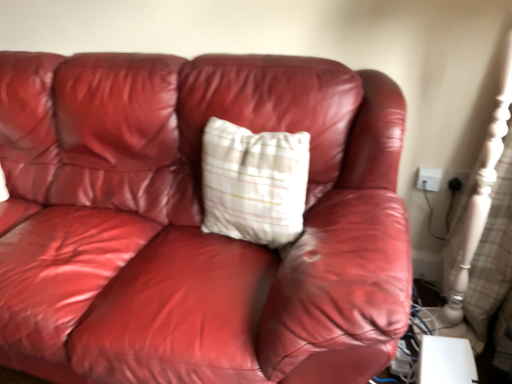
Question: Does plaid fabric pillow at center have a lesser height compared to black plastic outlet at upper right, the 1th electric outlet positioned from the right?

Choices:
 (A) yes
 (B) no

Answer: (B)

Question: Is plaid fabric pillow at center next to black plastic outlet at upper right, the 1th electric outlet positioned from the right?

Choices:
 (A) no
 (B) yes

Answer: (A)

Question: From the image's perspective, is plaid fabric pillow at center below black plastic outlet at upper right, the 2th electric outlet positioned from the left?

Choices:
 (A) yes
 (B) no

Answer: (A)

Question: Does plaid fabric pillow at center come behind black plastic outlet at upper right, the 2th electric outlet positioned from the left?

Choices:
 (A) no
 (B) yes

Answer: (A)

Question: Can you confirm if plaid fabric pillow at center is bigger than black plastic outlet at upper right, the 1th electric outlet positioned from the right?

Choices:
 (A) no
 (B) yes

Answer: (B)

Question: Is white plastic electric outlet at upper right, which is counted as the 2th electric outlet, starting from the right, wider or thinner than black plastic outlet at upper right, the 2th electric outlet positioned from the left?

Choices:
 (A) wide
 (B) thin

Answer: (A)

Question: From a real-world perspective, is white plastic electric outlet at upper right, arranged as the 1th electric outlet when viewed from the left, above or below black plastic outlet at upper right, the 2th electric outlet positioned from the left?

Choices:
 (A) below
 (B) above

Answer: (A)

Question: Is point (419, 185) closer or farther from the camera than point (453, 188)?

Choices:
 (A) closer
 (B) farther

Answer: (B)

Question: In the image, is white plastic electric outlet at upper right, which is counted as the 2th electric outlet, starting from the right, positioned in front of or behind black plastic outlet at upper right, the 2th electric outlet positioned from the left?

Choices:
 (A) behind
 (B) front

Answer: (A)

Question: Which is correct: black plastic outlet at upper right, the 2th electric outlet positioned from the left, is inside white plastic electric outlet at upper right, arranged as the 1th electric outlet when viewed from the left, or outside of it?

Choices:
 (A) outside
 (B) inside

Answer: (A)

Question: Is black plastic outlet at upper right, the 2th electric outlet positioned from the left, bigger or smaller than white plastic electric outlet at upper right, which is counted as the 2th electric outlet, starting from the right?

Choices:
 (A) small
 (B) big

Answer: (A)

Question: Would you say black plastic outlet at upper right, the 2th electric outlet positioned from the left, is to the left or to the right of white plastic electric outlet at upper right, arranged as the 1th electric outlet when viewed from the left, in the picture?

Choices:
 (A) left
 (B) right

Answer: (B)

Question: From a real-world perspective, relative to white plastic electric outlet at upper right, arranged as the 1th electric outlet when viewed from the left, is black plastic outlet at upper right, the 2th electric outlet positioned from the left, vertically above or below?

Choices:
 (A) below
 (B) above

Answer: (B)

Question: Is white plastic electric outlet at upper right, which is counted as the 2th electric outlet, starting from the right, bigger or smaller than plaid fabric pillow at center?

Choices:
 (A) big
 (B) small

Answer: (B)

Question: Is white plastic electric outlet at upper right, arranged as the 1th electric outlet when viewed from the left, in front of or behind plaid fabric pillow at center in the image?

Choices:
 (A) front
 (B) behind

Answer: (B)